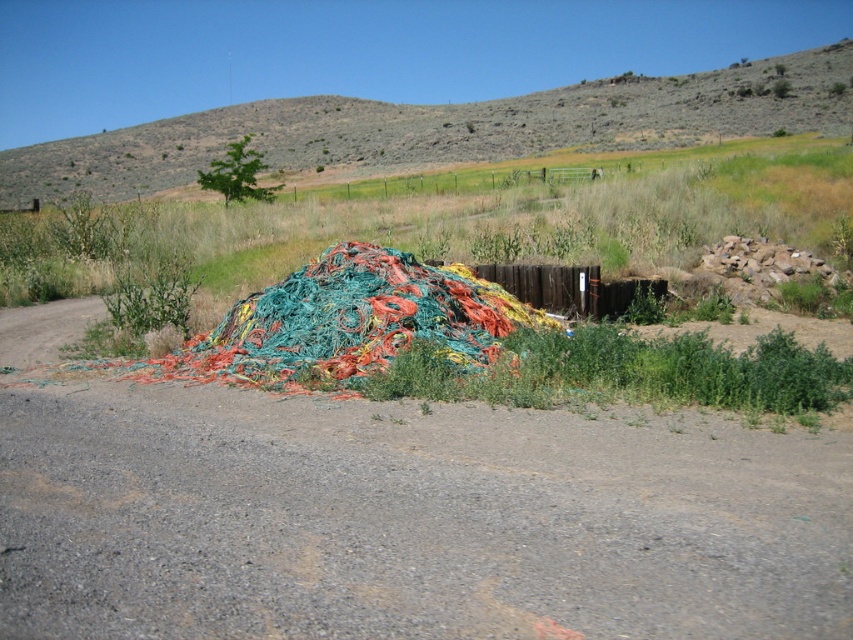
You are standing at the camera position and want to walk to the point labeled as point (138, 131). There is an obstacle at point (469, 529). Will you encounter the obstacle before reaching your destination?

Yes, you will encounter the obstacle at point (469, 529) before reaching point (138, 131) because point (469, 529) is closer to the camera than point (138, 131).